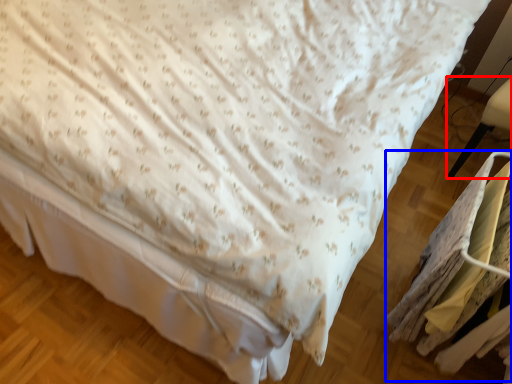
Question: Which object is further to the camera taking this photo, furniture (highlighted by a red box) or laundry (highlighted by a blue box)?

Choices:
 (A) furniture
 (B) laundry

Answer: (A)